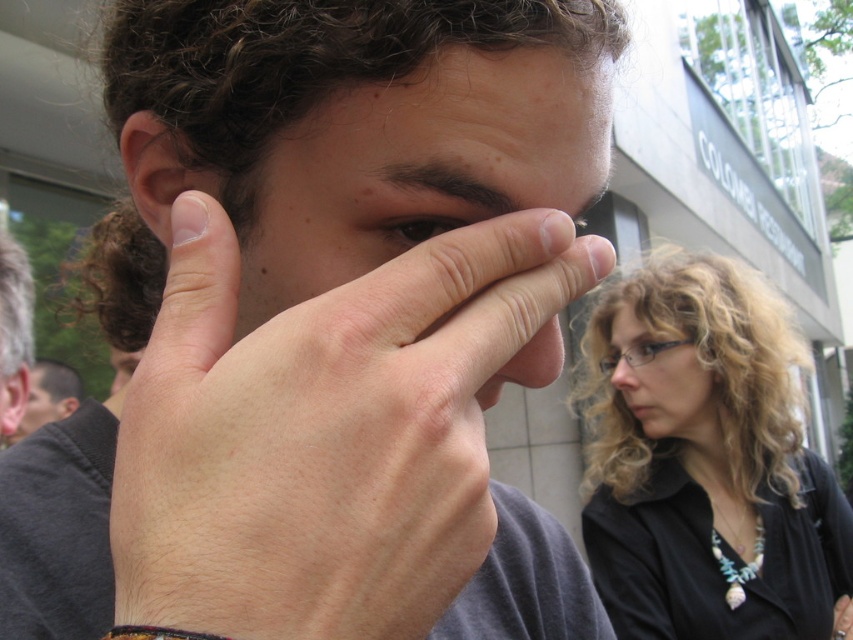
Is pale skin/hair at center to the left of matte skin face at center from the viewer's perspective?

Yes, pale skin/hair at center is to the left of matte skin face at center.

How far apart are pale skin/hair at center and matte skin face at center?

4.60 centimeters

Between point (262, 554) and point (508, 186), which one is positioned behind?

Point (508, 186)

Locate an element on the screen. The width and height of the screenshot is (853, 640). pale skin/hair at center is located at coordinates (325, 433).

Is pale skin/hair at center thinner than brown matte eye at center?

Incorrect, pale skin/hair at center's width is not less than brown matte eye at center's.

Is pale skin/hair at center positioned in front of brown matte eye at center?

Yes.

What do you see at coordinates (325, 433) in the screenshot? The height and width of the screenshot is (640, 853). I see `pale skin/hair at center` at bounding box center [325, 433].

The width and height of the screenshot is (853, 640). In order to click on pale skin/hair at center in this screenshot , I will do `click(325, 433)`.

Does pale skin/hair at center appear on the right side of gray hair at left?

Yes, pale skin/hair at center is to the right of gray hair at left.

Is point (247, 387) more distant than point (9, 353)?

No, (247, 387) is closer to viewer.

Which is behind, point (456, 346) or point (7, 422)?

The point (7, 422) is behind.

This screenshot has height=640, width=853. In order to click on pale skin/hair at center in this screenshot , I will do `click(325, 433)`.